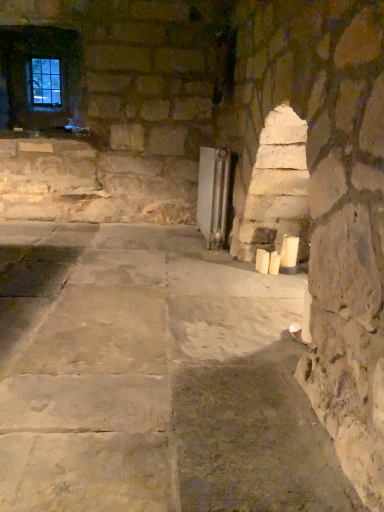
Question: Does white wax candle at lower right, the second candle positioned from the left, have a smaller size compared to clear glass window at upper left?

Choices:
 (A) yes
 (B) no

Answer: (A)

Question: From a real-world perspective, is white wax candle at lower right, the second candle positioned from the left, positioned under clear glass window at upper left based on gravity?

Choices:
 (A) no
 (B) yes

Answer: (B)

Question: Considering the relative sizes of white wax candle at lower right, the second candle positioned from the left, and clear glass window at upper left in the image provided, is white wax candle at lower right, the second candle positioned from the left, shorter than clear glass window at upper left?

Choices:
 (A) yes
 (B) no

Answer: (A)

Question: Can you confirm if white wax candle at lower right, acting as the 2th candle starting from the right, is positioned to the right of clear glass window at upper left?

Choices:
 (A) no
 (B) yes

Answer: (B)

Question: From a real-world perspective, is white wax candle at lower right, acting as the 2th candle starting from the right, positioned over clear glass window at upper left based on gravity?

Choices:
 (A) no
 (B) yes

Answer: (A)

Question: In the image, is white matte candle at center-right, which is counted as the 3th candle, starting from the right, positioned in front of or behind white wax candle at right, the third candle positioned from the left?

Choices:
 (A) behind
 (B) front

Answer: (A)

Question: Which is correct: white matte candle at center-right, which is counted as the 3th candle, starting from the right, is inside white wax candle at right, the third candle positioned from the left, or outside of it?

Choices:
 (A) outside
 (B) inside

Answer: (A)

Question: From the image's perspective, is white matte candle at center-right, the 1th candle viewed from the left, above or below white wax candle at right, the third candle positioned from the left?

Choices:
 (A) below
 (B) above

Answer: (A)

Question: Is white matte candle at center-right, which is counted as the 3th candle, starting from the right, wider or thinner than white wax candle at right, the third candle positioned from the left?

Choices:
 (A) wide
 (B) thin

Answer: (B)

Question: Is clear glass window at upper left wider or thinner than white wax candle at lower right, acting as the 2th candle starting from the right?

Choices:
 (A) wide
 (B) thin

Answer: (A)

Question: From their relative heights in the image, would you say clear glass window at upper left is taller or shorter than white wax candle at lower right, the second candle positioned from the left?

Choices:
 (A) short
 (B) tall

Answer: (B)

Question: Would you say clear glass window at upper left is to the left or to the right of white wax candle at lower right, the second candle positioned from the left, in the picture?

Choices:
 (A) left
 (B) right

Answer: (A)

Question: From a real-world perspective, is clear glass window at upper left positioned above or below white wax candle at lower right, acting as the 2th candle starting from the right?

Choices:
 (A) above
 (B) below

Answer: (A)

Question: From a real-world perspective, is white wax candle at right, placed as the 1th candle when sorted from right to left, physically located above or below white wax candle at lower right, acting as the 2th candle starting from the right?

Choices:
 (A) below
 (B) above

Answer: (B)

Question: Does point (292, 253) appear closer or farther from the camera than point (269, 272)?

Choices:
 (A) farther
 (B) closer

Answer: (A)